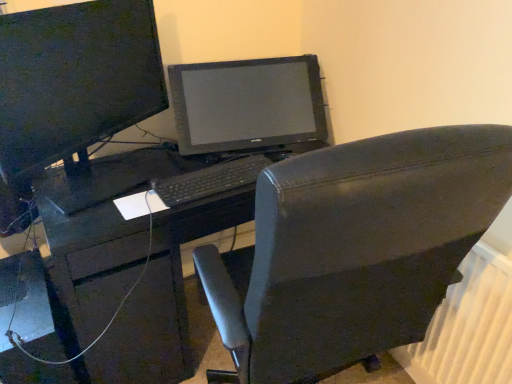
Where is `vacant region above black plastic keyboard at center (from a real-world perspective)`? The width and height of the screenshot is (512, 384). vacant region above black plastic keyboard at center (from a real-world perspective) is located at coordinates (209, 174).